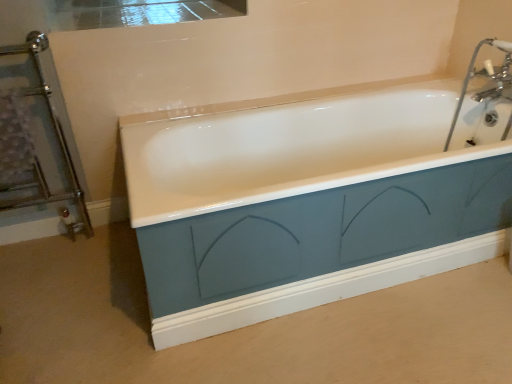
Question: Should I look upward or downward to see chrome metallic faucet at upper right?

Choices:
 (A) up
 (B) down

Answer: (A)

Question: From a real-world perspective, is chrome metallic faucet at upper right on chrome metallic towel rack at left?

Choices:
 (A) yes
 (B) no

Answer: (A)

Question: Is chrome metallic faucet at upper right to the right of chrome metallic towel rack at left from the viewer's perspective?

Choices:
 (A) no
 (B) yes

Answer: (B)

Question: Does chrome metallic faucet at upper right appear on the left side of chrome metallic towel rack at left?

Choices:
 (A) no
 (B) yes

Answer: (A)

Question: Can you confirm if chrome metallic faucet at upper right is smaller than chrome metallic towel rack at left?

Choices:
 (A) yes
 (B) no

Answer: (A)

Question: Does chrome metallic faucet at upper right have a lesser width compared to chrome metallic towel rack at left?

Choices:
 (A) no
 (B) yes

Answer: (A)

Question: Would you say chrome metallic faucet at upper right is outside chrome metallic towel rack at left?

Choices:
 (A) yes
 (B) no

Answer: (A)

Question: Is chrome metallic towel rack at left positioned before chrome metallic faucet at upper right?

Choices:
 (A) no
 (B) yes

Answer: (B)

Question: From a real-world perspective, is chrome metallic towel rack at left located beneath chrome metallic faucet at upper right?

Choices:
 (A) yes
 (B) no

Answer: (A)

Question: From the image's perspective, is chrome metallic towel rack at left beneath chrome metallic faucet at upper right?

Choices:
 (A) no
 (B) yes

Answer: (B)

Question: Does chrome metallic towel rack at left have a lesser width compared to chrome metallic faucet at upper right?

Choices:
 (A) yes
 (B) no

Answer: (A)

Question: Does chrome metallic towel rack at left contain chrome metallic faucet at upper right?

Choices:
 (A) yes
 (B) no

Answer: (B)

Question: Does chrome metallic towel rack at left appear on the right side of chrome metallic faucet at upper right?

Choices:
 (A) yes
 (B) no

Answer: (B)

Question: From a real-world perspective, is chrome metallic faucet at upper right above or below chrome metallic towel rack at left?

Choices:
 (A) above
 (B) below

Answer: (A)